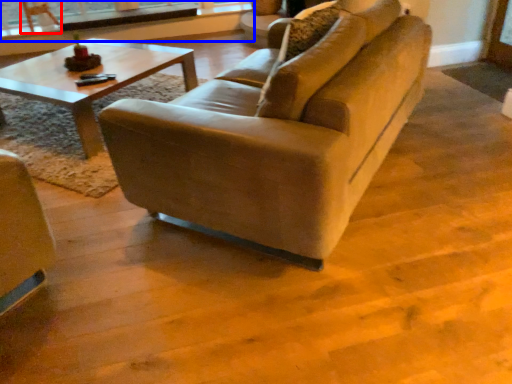
Question: Which object is further to the camera taking this photo, armchair (highlighted by a red box) or window frame (highlighted by a blue box)?

Choices:
 (A) armchair
 (B) window frame

Answer: (B)